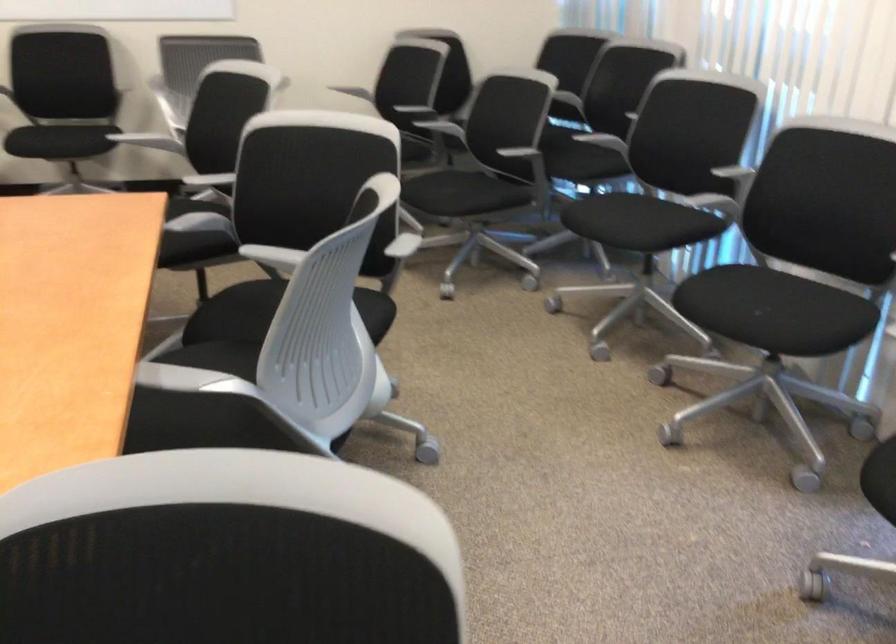
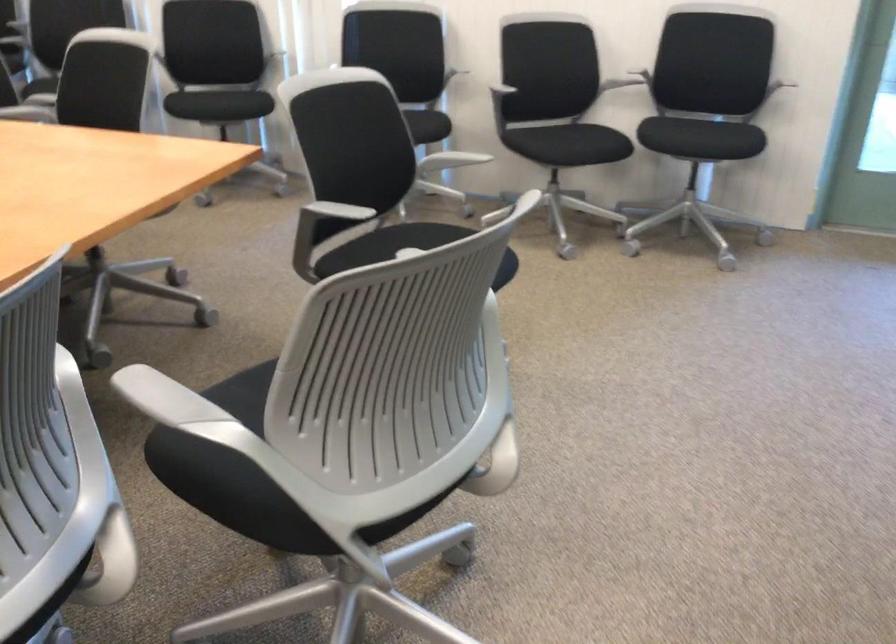
Question: I am providing you with two images of the same scene from different viewpoints. Which of the following objects are not visible in image2?

Choices:
 (A) blue broom handle
 (B) gray adjustment knob
 (C) chair sitting surface
 (D) gray chair armrest

Answer: (C)